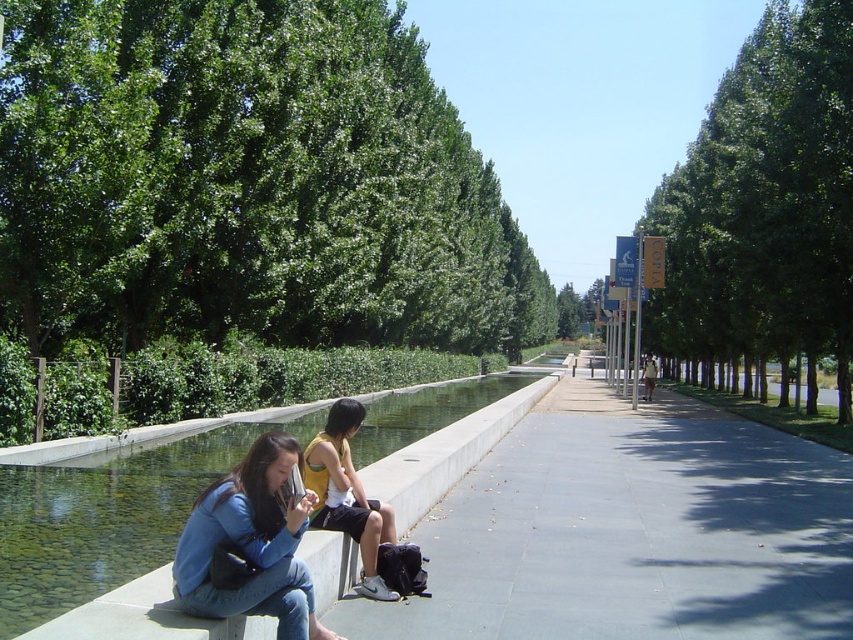
Question: Can you confirm if green concrete waterway at lower left is thinner than yellow jersey at center?

Choices:
 (A) no
 (B) yes

Answer: (A)

Question: Which point appears farthest from the camera in this image?

Choices:
 (A) (154, 276)
 (B) (379, 582)

Answer: (A)

Question: Which object appears closest to the camera in this image?

Choices:
 (A) blue denim jeans at lower left
 (B) green concrete waterway at lower left
 (C) yellow jersey at center

Answer: (B)

Question: Which object is positioned closest to the green leafy trees at center?

Choices:
 (A) blue denim jeans at lower left
 (B) yellow jersey at center
 (C) green concrete waterway at lower left

Answer: (C)

Question: Observing the image, what is the correct spatial positioning of green leafy tree at right in reference to green concrete waterway at lower left?

Choices:
 (A) left
 (B) right

Answer: (B)

Question: Is green leafy tree at right below green concrete waterway at lower left?

Choices:
 (A) no
 (B) yes

Answer: (A)